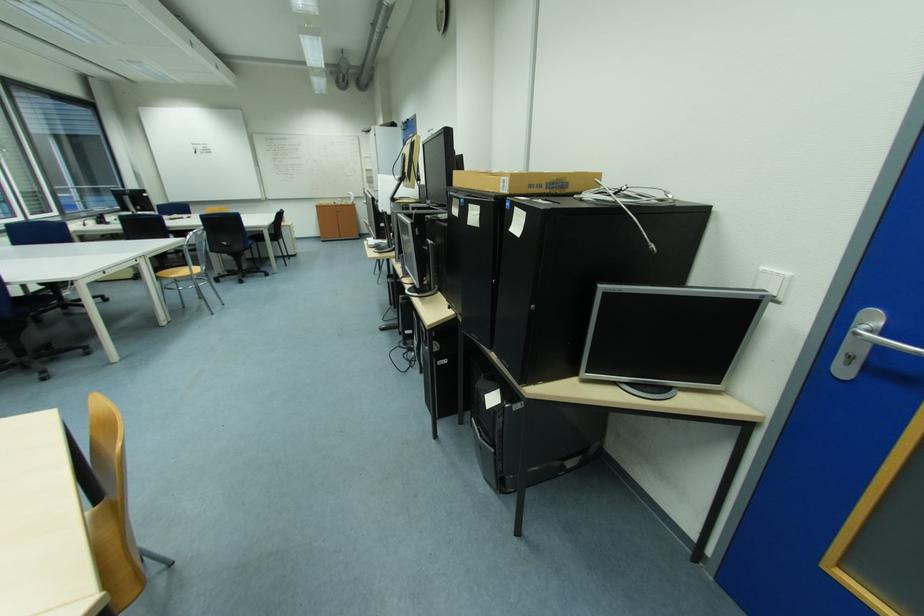
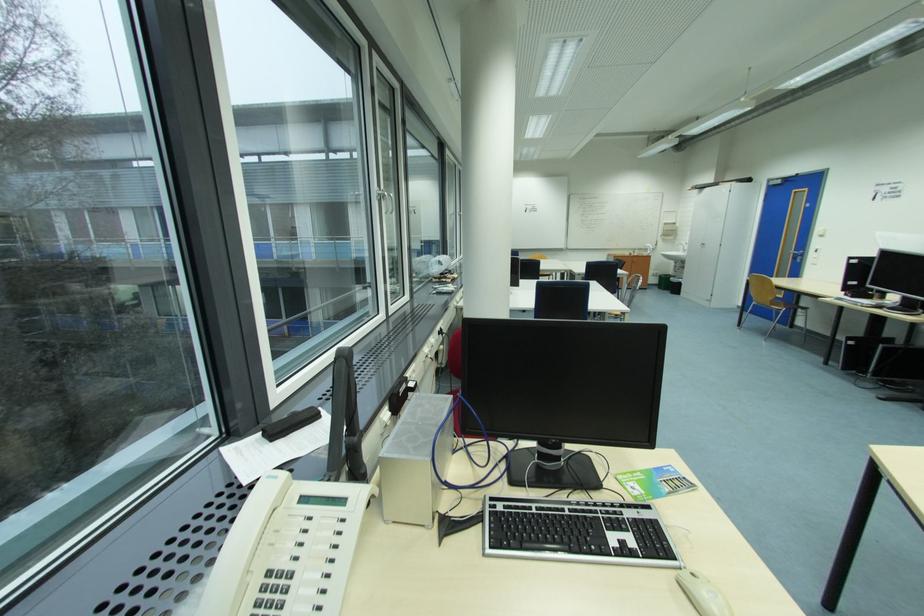
Question: The images are taken continuously from a first-person perspective. In which direction are you moving?

Choices:
 (A) Left
 (B) Right
 (C) Forward
 (D) Backward

Answer: (A)